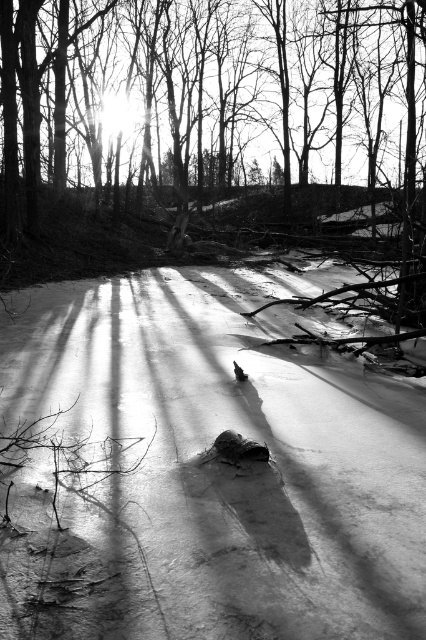
You are standing at the edge of the frozen pond and want to walk towards the center. According to the coordinates provided, where should you aim to step on the white matte snow at center?

The white matte snow at center is located at coordinates point (213, 468), so you should aim to step towards that point.

You are standing at the edge of the frozen pond and see the white matte snow at center and the silhouette bare tree at center. Which object is closer to your right side?

The silhouette bare tree at center is closer to your right side because the white matte snow at center is positioned to the left of it.